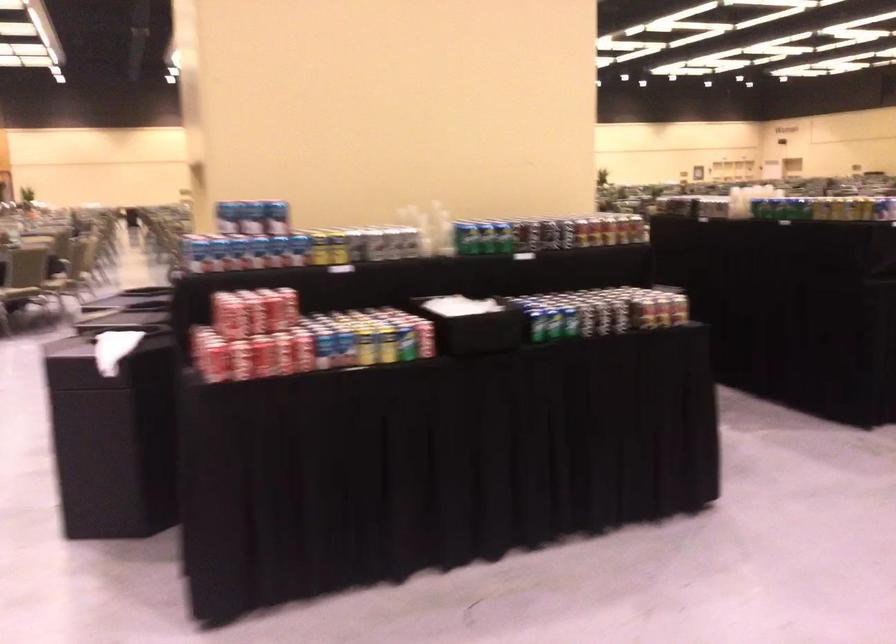
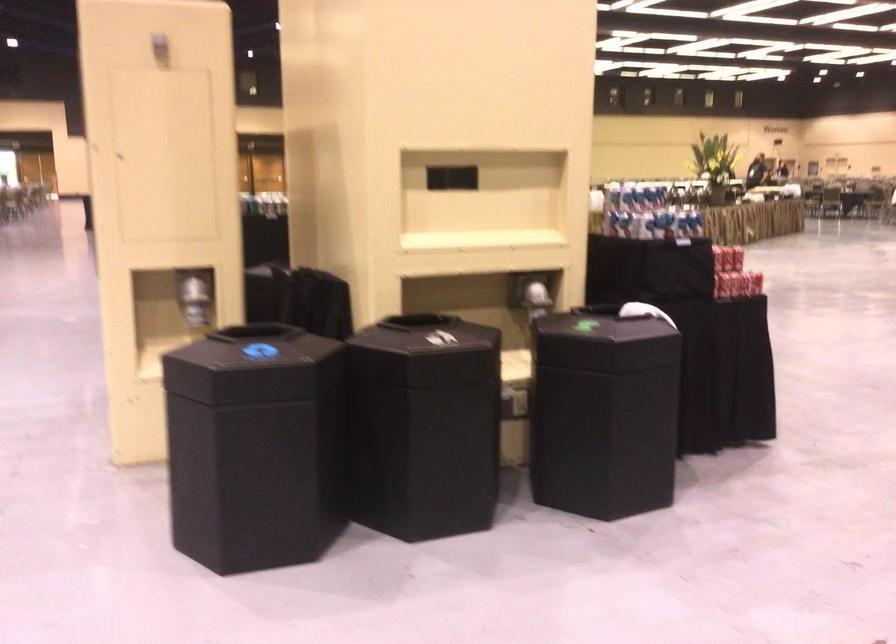
Question: I am providing you with two images of the same scene from different viewpoints. After the viewpoint changes to image2, which objects are now occluded?

Choices:
 (A) black bin lid
 (B) green whiteboard eraser
 (C) silver soda can
 (D) shiny dispenser lever

Answer: (C)